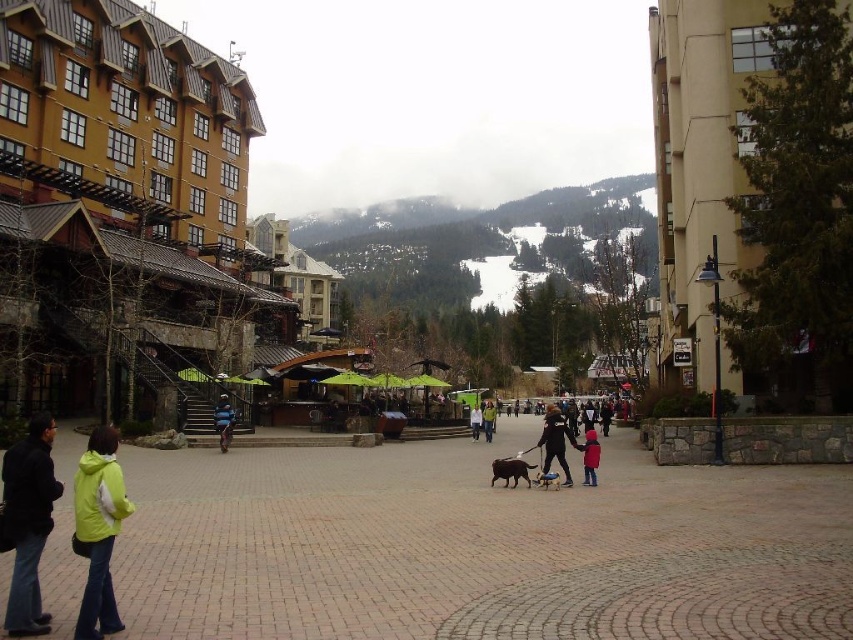
Question: Which point appears closest to the camera in this image?

Choices:
 (A) (223, 408)
 (B) (97, 621)
 (C) (485, 404)
 (D) (537, 484)

Answer: (B)

Question: Which point is farther to the camera?

Choices:
 (A) brown furry dog at center
 (B) light green fleece jacket at lower left
 (C) brick pavement at center
 (D) brown fur dog at center

Answer: (D)

Question: Can you confirm if brick pavement at center is positioned to the right of matte black jacket at lower left?

Choices:
 (A) no
 (B) yes

Answer: (B)

Question: Which point is closer to the camera?

Choices:
 (A) light blue denim jacket at center
 (B) dark blue jacket at center
 (C) matte black jacket at lower left

Answer: (C)

Question: Can you confirm if light blue denim jacket at center is positioned to the right of light blue jacket at center?

Choices:
 (A) no
 (B) yes

Answer: (B)

Question: Can you confirm if brown furry dog at center is positioned above light blue jacket at center?

Choices:
 (A) no
 (B) yes

Answer: (B)